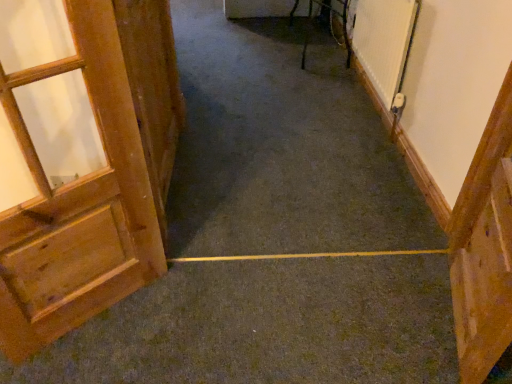
Question: From the image's perspective, would you say wooden door at right, which appears as the 1th door when viewed from the right, is positioned over metallic silver chair at upper right?

Choices:
 (A) yes
 (B) no

Answer: (B)

Question: From a real-world perspective, is wooden door at right, the third door in the left-to-right sequence, on top of metallic silver chair at upper right?

Choices:
 (A) yes
 (B) no

Answer: (A)

Question: Can you confirm if wooden door at right, which appears as the 1th door when viewed from the right, is smaller than metallic silver chair at upper right?

Choices:
 (A) no
 (B) yes

Answer: (B)

Question: Is the surface of wooden door at right, which appears as the 1th door when viewed from the right, in direct contact with metallic silver chair at upper right?

Choices:
 (A) no
 (B) yes

Answer: (A)

Question: Is metallic silver chair at upper right surrounded by wooden door at right, which appears as the 1th door when viewed from the right?

Choices:
 (A) no
 (B) yes

Answer: (A)

Question: Is wooden door at right, which appears as the 1th door when viewed from the right, wider than metallic silver chair at upper right?

Choices:
 (A) no
 (B) yes

Answer: (A)

Question: Considering the relative sizes of metallic silver chair at upper right and wooden door at left, arranged as the 2th door when viewed from the left, in the image provided, is metallic silver chair at upper right smaller than wooden door at left, arranged as the 2th door when viewed from the left,?

Choices:
 (A) yes
 (B) no

Answer: (B)

Question: Considering the relative positions of metallic silver chair at upper right and wooden door at left, the second door from the right, in the image provided, is metallic silver chair at upper right in front of wooden door at left, the second door from the right,?

Choices:
 (A) no
 (B) yes

Answer: (A)

Question: Is metallic silver chair at upper right looking in the opposite direction of wooden door at left, arranged as the 2th door when viewed from the left?

Choices:
 (A) no
 (B) yes

Answer: (A)

Question: Can you confirm if metallic silver chair at upper right is taller than wooden door at left, arranged as the 2th door when viewed from the left?

Choices:
 (A) yes
 (B) no

Answer: (B)

Question: From the image's perspective, is metallic silver chair at upper right on top of wooden door at left, the second door from the right?

Choices:
 (A) no
 (B) yes

Answer: (B)

Question: Would you say metallic silver chair at upper right contains wooden door at left, arranged as the 2th door when viewed from the left?

Choices:
 (A) no
 (B) yes

Answer: (A)

Question: Can wooden door at right, the third door in the left-to-right sequence, be found inside wooden door at left, which is the first door in left-to-right order?

Choices:
 (A) no
 (B) yes

Answer: (A)